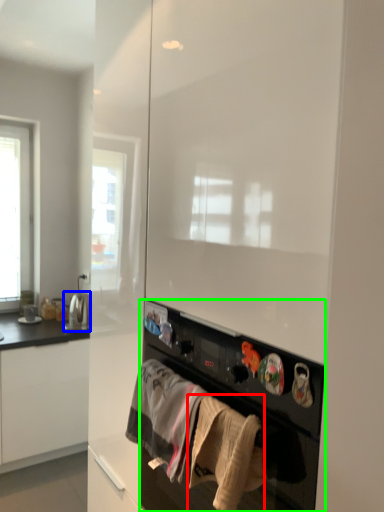
Question: Considering the real-world distances, which object is farthest from clothing (highlighted by a red box)? appliance (highlighted by a blue box) or home appliance (highlighted by a green box)?

Choices:
 (A) appliance
 (B) home appliance

Answer: (A)